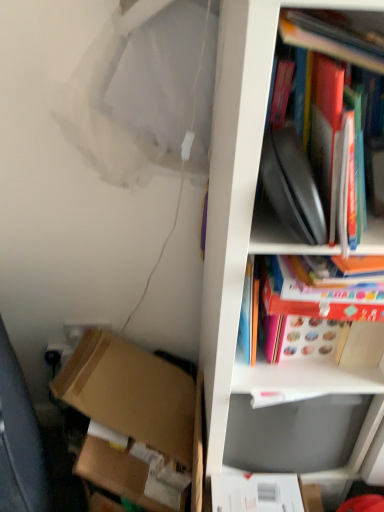
Question: Considering the relative sizes of matte red book at upper right, which appears as the first book when ordered from the bottom, and brown cardboard box at lower left in the image provided, is matte red book at upper right, which appears as the first book when ordered from the bottom, shorter than brown cardboard box at lower left?

Choices:
 (A) no
 (B) yes

Answer: (B)

Question: Does matte red book at upper right, the 2th book positioned from the top, have a larger size compared to brown cardboard box at lower left?

Choices:
 (A) yes
 (B) no

Answer: (B)

Question: Considering the relative sizes of matte red book at upper right, the 2th book positioned from the top, and brown cardboard box at lower left in the image provided, is matte red book at upper right, the 2th book positioned from the top, thinner than brown cardboard box at lower left?

Choices:
 (A) no
 (B) yes

Answer: (B)

Question: From a real-world perspective, is matte red book at upper right, the 2th book positioned from the top, located higher than brown cardboard box at lower left?

Choices:
 (A) no
 (B) yes

Answer: (B)

Question: Is matte red book at upper right, the 2th book positioned from the top, positioned with its back to brown cardboard box at lower left?

Choices:
 (A) yes
 (B) no

Answer: (B)

Question: Would you say matte red book at upper right, the 2th book positioned from the top, is inside or outside white matte cabinet at right?

Choices:
 (A) outside
 (B) inside

Answer: (B)

Question: From a real-world perspective, relative to white matte cabinet at right, is matte red book at upper right, the 2th book positioned from the top, vertically above or below?

Choices:
 (A) above
 (B) below

Answer: (A)

Question: Is matte red book at upper right, the 2th book positioned from the top, to the left or to the right of white matte cabinet at right in the image?

Choices:
 (A) right
 (B) left

Answer: (B)

Question: From their relative heights in the image, would you say matte red book at upper right, the 2th book positioned from the top, is taller or shorter than white matte cabinet at right?

Choices:
 (A) tall
 (B) short

Answer: (B)

Question: Is brown cardboard box at lower left spatially inside white matte cabinet at right, or outside of it?

Choices:
 (A) outside
 (B) inside

Answer: (A)

Question: From a real-world perspective, is brown cardboard box at lower left above or below white matte cabinet at right?

Choices:
 (A) above
 (B) below

Answer: (B)

Question: In terms of width, does brown cardboard box at lower left look wider or thinner when compared to white matte cabinet at right?

Choices:
 (A) wide
 (B) thin

Answer: (B)

Question: From their relative heights in the image, would you say brown cardboard box at lower left is taller or shorter than white matte cabinet at right?

Choices:
 (A) short
 (B) tall

Answer: (A)

Question: In the image, is brown cardboard box at lower left positioned in front of or behind matte red book at upper right, the 2th book positioned from the top?

Choices:
 (A) front
 (B) behind

Answer: (B)

Question: In terms of height, does brown cardboard box at lower left look taller or shorter compared to matte red book at upper right, the 2th book positioned from the top?

Choices:
 (A) short
 (B) tall

Answer: (B)